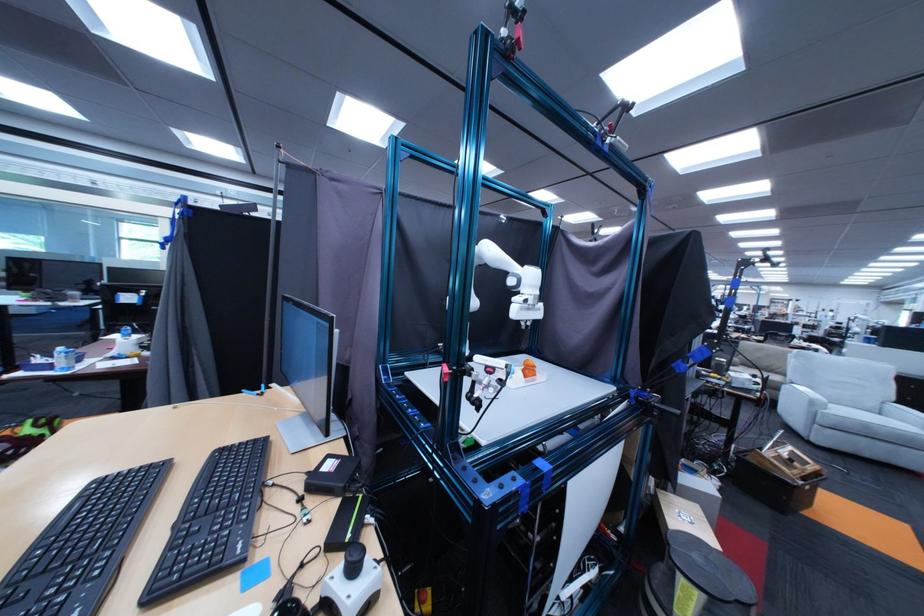
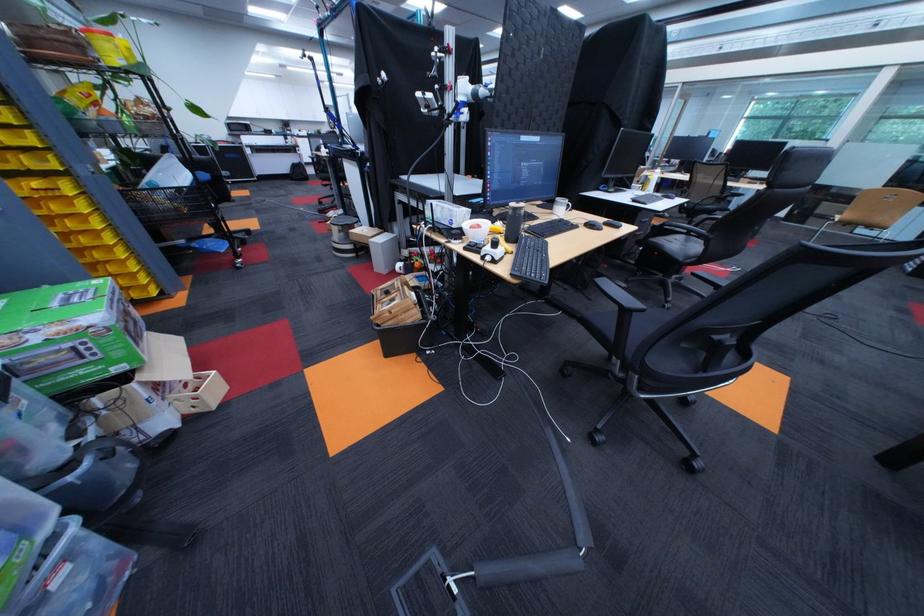
Question: I am providing you with two images of the same scene from different viewpoints. Please identify which objects are invisible in image2.

Choices:
 (A) yellow plastic bin
 (B) orange printed object
 (C) silver adjustment knob
 (D) chair sitting surface

Answer: (B)